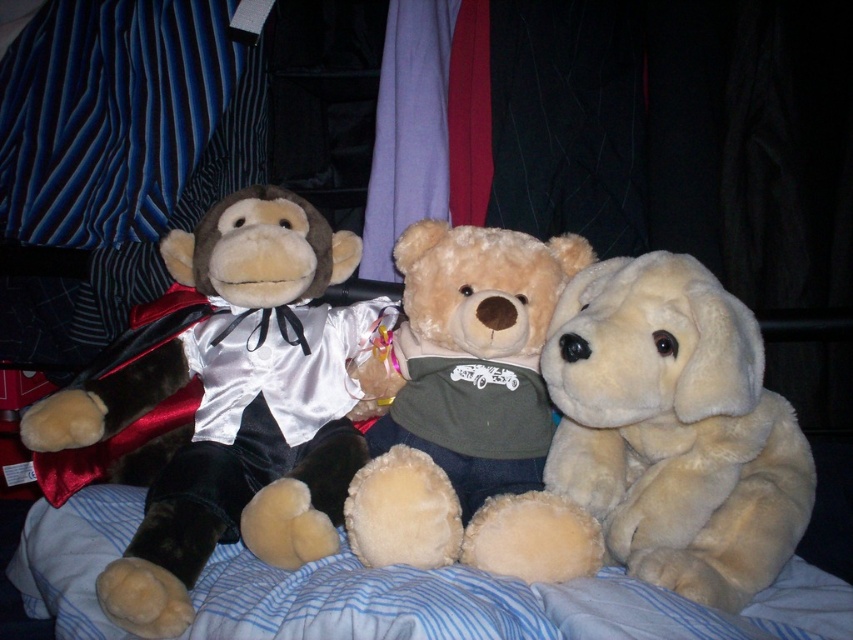
Can you confirm if velvet monkey at left is shorter than soft plush teddy bear at center?

In fact, velvet monkey at left may be taller than soft plush teddy bear at center.

Does point (270, 339) come behind point (462, 376)?

Yes, point (270, 339) is farther from viewer.

Locate an element on the screen. velvet monkey at left is located at coordinates (238, 403).

Does fluffy cream teddy bear at right appear under soft plush teddy bear at center?

Correct, fluffy cream teddy bear at right is located below soft plush teddy bear at center.

Can you confirm if fluffy cream teddy bear at right is positioned to the left of soft plush teddy bear at center?

In fact, fluffy cream teddy bear at right is to the right of soft plush teddy bear at center.

Is point (743, 404) positioned in front of point (422, 225)?

Yes, point (743, 404) is in front of point (422, 225).

Image resolution: width=853 pixels, height=640 pixels. In order to click on fluffy cream teddy bear at right in this screenshot , I will do `click(674, 428)`.

Does velvet monkey at left have a larger size compared to fluffy cream teddy bear at right?

Yes.

Between velvet monkey at left and fluffy cream teddy bear at right, which one is positioned higher?

velvet monkey at left is above.

At what (x,y) coordinates should I click in order to perform the action: click on velvet monkey at left. Please return your answer as a coordinate pair (x, y). Image resolution: width=853 pixels, height=640 pixels. Looking at the image, I should click on (238, 403).

Locate an element on the screen. The width and height of the screenshot is (853, 640). velvet monkey at left is located at coordinates (238, 403).